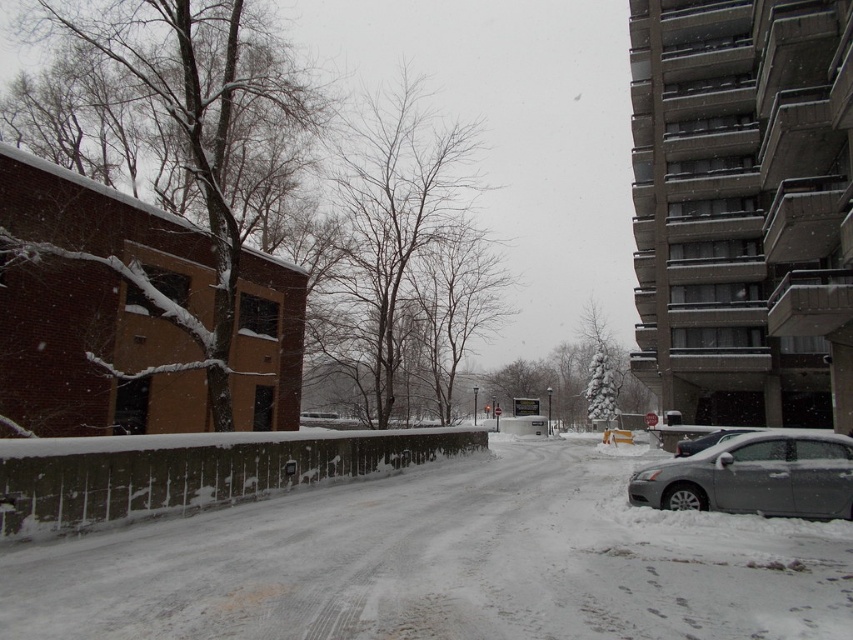
You are a delivery person needing to park your vehicle on the snowy ground. The parking spot is at the center of the image. There is a white powdery snow at center and a sleek metallic sedan at right. Is the parking spot clear of any vehicles?

The white powdery snow at center is located below the sleek metallic sedan at right, which means the parking spot at the center is currently occupied by the sedan, so it is not clear.

You are a delivery person needing to park your vehicle in the snowy area shown. The parking spot is marked by the white powdery snow at center. Can your vehicle, which is the same size as the sleek metallic sedan at right, fit into the parking spot?

The white powdery snow at center is bigger than the sleek metallic sedan at right, so yes, the parking spot marked by the white powdery snow at center is large enough to accommodate a vehicle of that size.